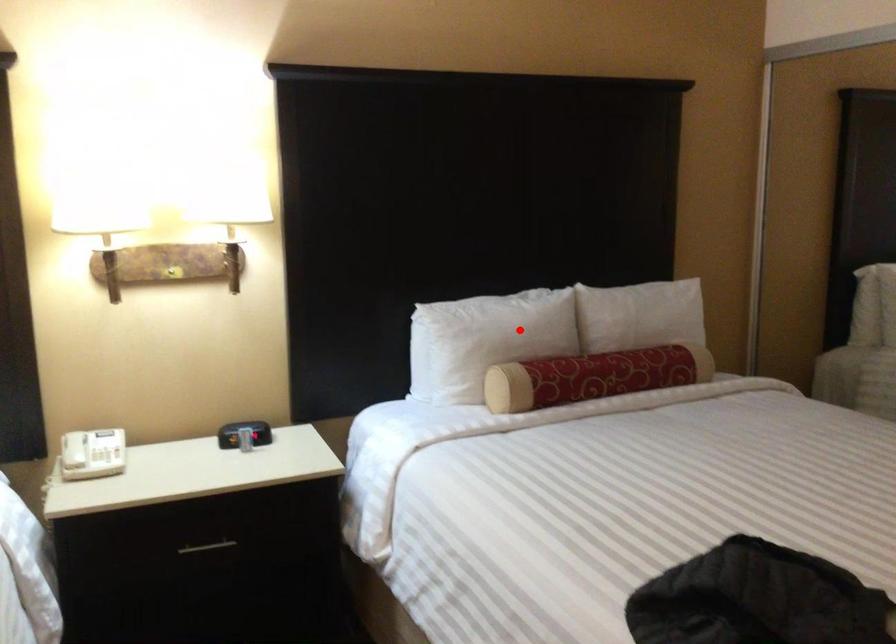
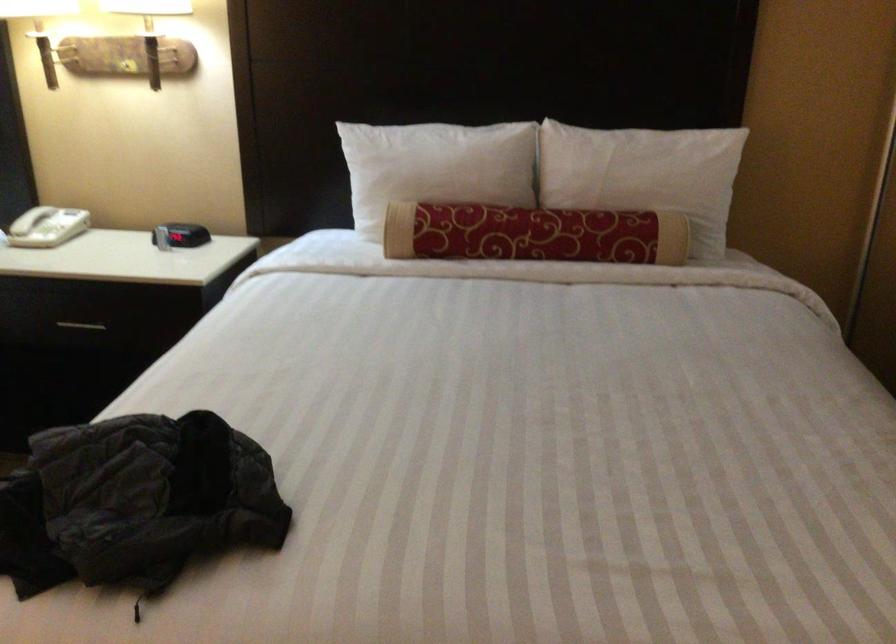
The point at the highlighted location is marked in the first image. Where is the corresponding point in the second image?

(435, 167)